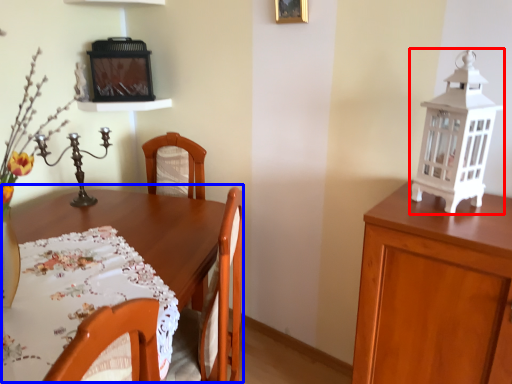
Question: Among these objects, which one is farthest to the camera, lantern (highlighted by a red box) or table (highlighted by a blue box)?

Choices:
 (A) lantern
 (B) table

Answer: (A)